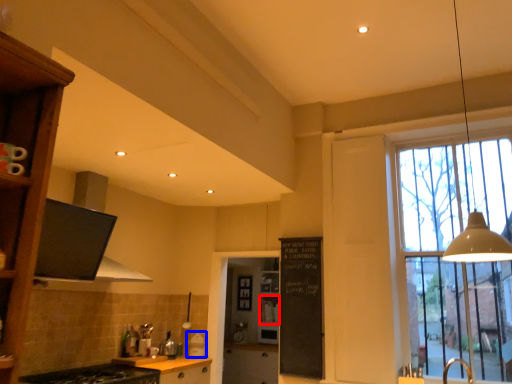
Question: Among these objects, which one is nearest to the camera, shelf (highlighted by a red box) or appliance (highlighted by a blue box)?

Choices:
 (A) shelf
 (B) appliance

Answer: (B)